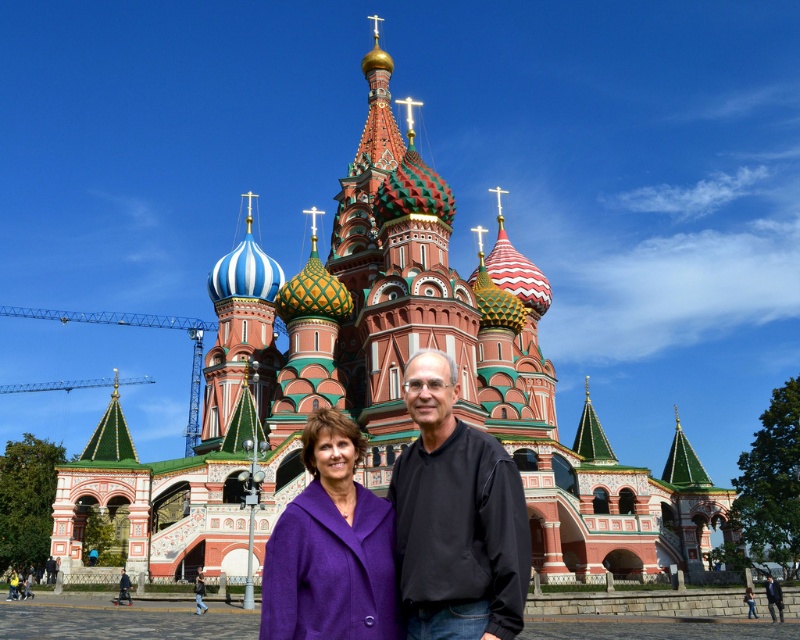
The image size is (800, 640). What do you see at coordinates (454, 516) in the screenshot?
I see `black matte shirt at center` at bounding box center [454, 516].

At what (x,y) coordinates should I click in order to perform the action: click on black matte shirt at center. Please return your answer as a coordinate pair (x, y). Looking at the image, I should click on (454, 516).

Locate an element on the screen. This screenshot has height=640, width=800. black matte shirt at center is located at coordinates (454, 516).

Is point (350, 609) more distant than point (774, 618)?

No, it is not.

What do you see at coordinates (330, 547) in the screenshot?
I see `purple woolen coat at center` at bounding box center [330, 547].

Between point (292, 637) and point (768, 588), which one is positioned behind?

Point (768, 588)

Where is `purple woolen coat at center`? purple woolen coat at center is located at coordinates (330, 547).

Does black matte shirt at center lie in front of black smooth suit at center?

Yes, black matte shirt at center is in front of black smooth suit at center.

Can you confirm if black matte shirt at center is shorter than black smooth suit at center?

No, black matte shirt at center is not shorter than black smooth suit at center.

Does point (421, 563) come in front of point (782, 602)?

That is True.

The image size is (800, 640). I want to click on black matte shirt at center, so point(454,516).